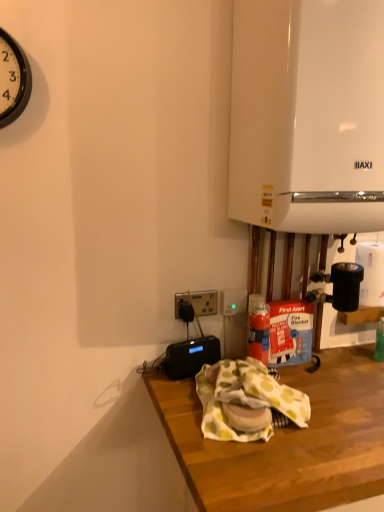
Question: Relative to wooden desk at lower center, is black plastic radio at lower center, which is the 2th appliance in right-to-left order, in front or behind?

Choices:
 (A) front
 (B) behind

Answer: (B)

Question: Visually, is black plastic radio at lower center, the 1th appliance from the bottom, positioned to the left or to the right of wooden desk at lower center?

Choices:
 (A) left
 (B) right

Answer: (A)

Question: Which object is positioned farthest from the wooden desk at lower center?

Choices:
 (A) white matte paper towel at right
 (B) black plastic socket at center
 (C) black plastic radio at lower center, which appears as the first appliance when viewed from the left
 (D) black plastic clock at upper left
 (E) black plastic power outlet at center

Answer: (D)

Question: Based on their relative distances, which object is nearer to the black plastic socket at center?

Choices:
 (A) wooden desk at lower center
 (B) white glossy boiler at upper right, arranged as the first appliance when viewed from the top
 (C) black plastic power outlet at center
 (D) white matte paper towel at right
 (E) black plastic radio at lower center, arranged as the 2th appliance when viewed from the top

Answer: (C)